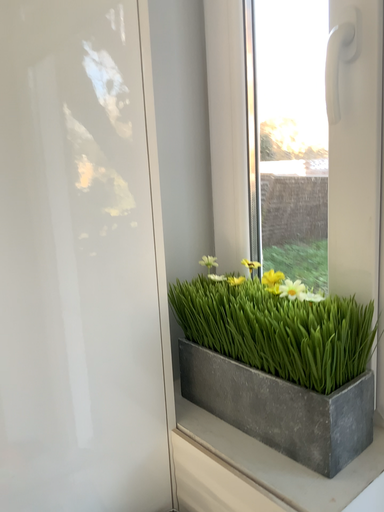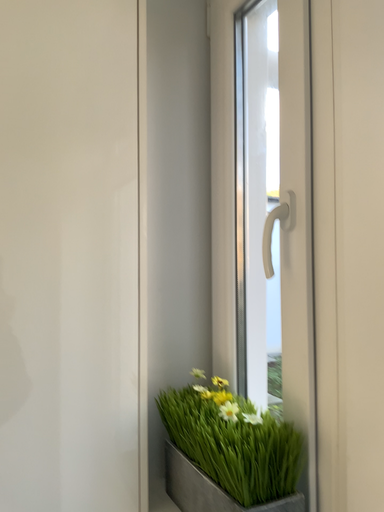
Question: How did the camera likely rotate when shooting the video?

Choices:
 (A) rotated right
 (B) rotated left

Answer: (B)